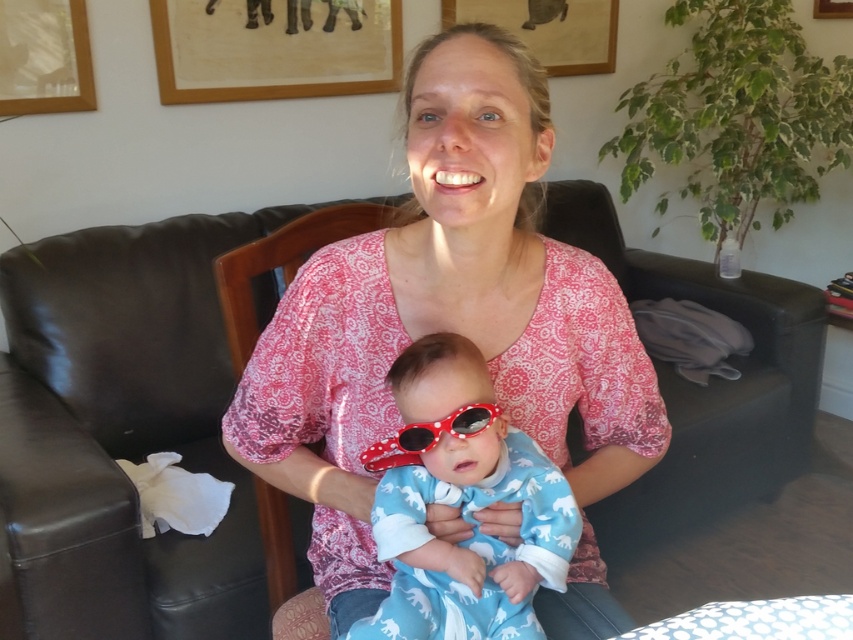
You are a photographer adjusting your camera to focus on the baby in the image. The camera has a focus point at the coordinates point (445, 316). Which object will the camera focus on?

The point (445, 316) corresponds to the pink printed blouse at center, so the camera will focus on the pink printed blouse at center instead of the baby.